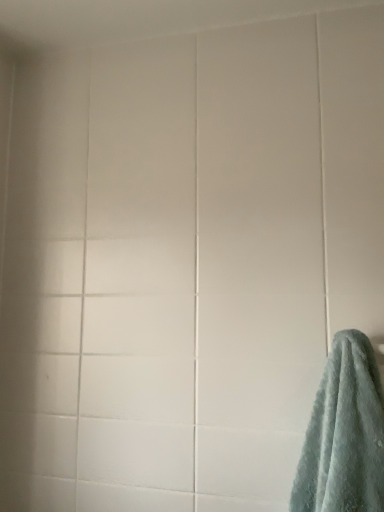
Where is `teal soft towel at lower right`? teal soft towel at lower right is located at coordinates (344, 434).

In order to face teal soft towel at lower right, should I rotate leftwards or rightwards?

A 16.544 degree turn to the right will do.

This screenshot has width=384, height=512. What do you see at coordinates (344, 434) in the screenshot?
I see `teal soft towel at lower right` at bounding box center [344, 434].

Locate an element on the screen. The image size is (384, 512). teal soft towel at lower right is located at coordinates (344, 434).